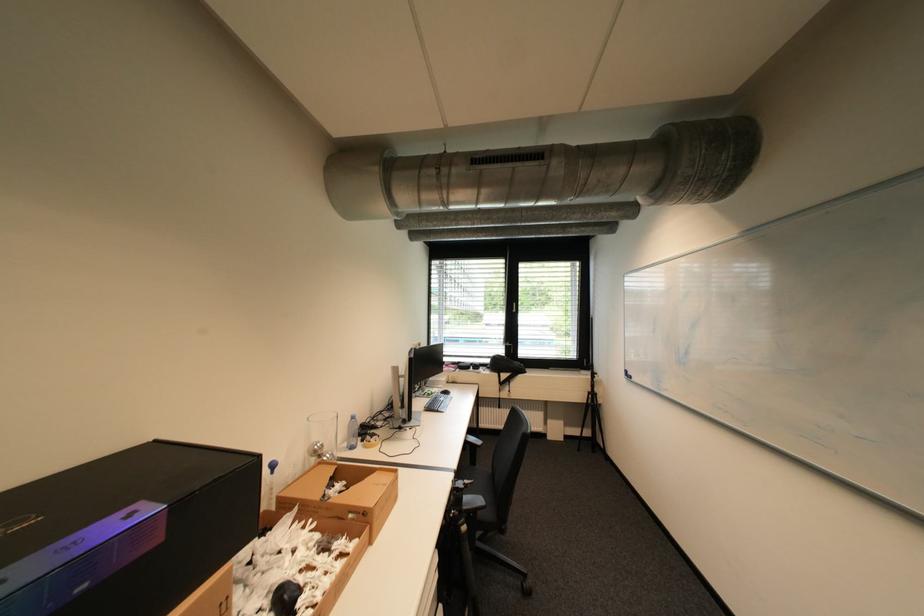
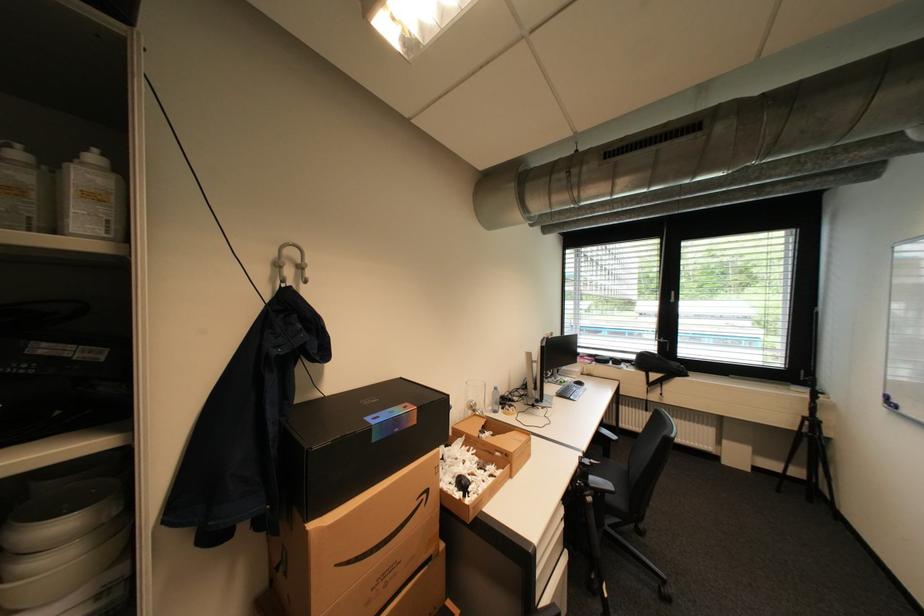
Locate, in the second image, the point that corresponds to point (91, 586) in the first image.

(405, 431)